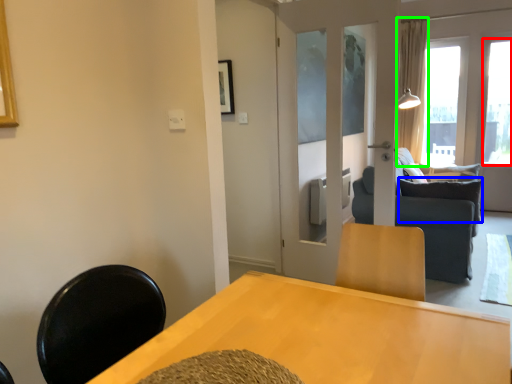
Question: Which object is the farthest from window (highlighted by a red box)? Choose among these: pillow (highlighted by a blue box) or curtain (highlighted by a green box).

Choices:
 (A) pillow
 (B) curtain

Answer: (A)